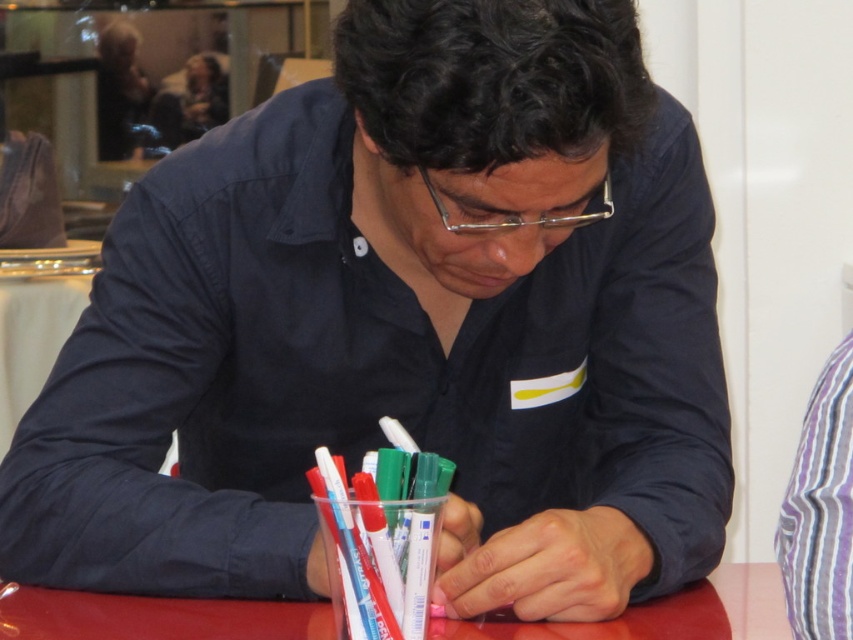
Which is above, red glossy table at center or purple striped shirt at right?

purple striped shirt at right is above.

Locate an element on the screen. This screenshot has width=853, height=640. red glossy table at center is located at coordinates (155, 618).